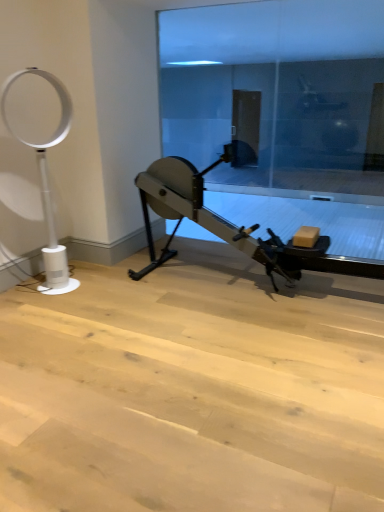
Question: Considering their positions, is transparent glass door at center located in front of or behind white plastic fan at left?

Choices:
 (A) front
 (B) behind

Answer: (B)

Question: Would you say transparent glass door at center is inside or outside white plastic fan at left?

Choices:
 (A) inside
 (B) outside

Answer: (B)

Question: Which object is the farthest from the white plastic fan at left?

Choices:
 (A) metallic gray stationary bicycle at center
 (B) transparent glass door at center

Answer: (B)

Question: Estimate the real-world distances between objects in this image. Which object is closer to the transparent glass door at center?

Choices:
 (A) metallic gray stationary bicycle at center
 (B) white plastic fan at left

Answer: (A)